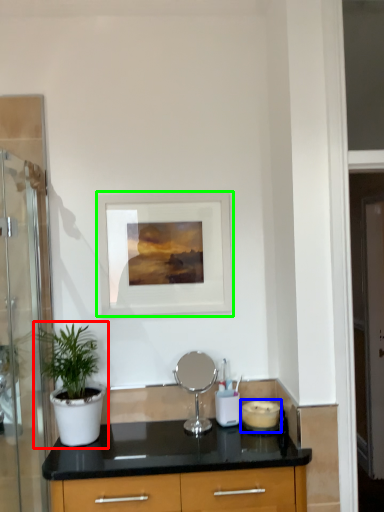
Question: Which is farther away from houseplant (highlighted by a red box)? appliance (highlighted by a blue box) or picture frame (highlighted by a green box)?

Choices:
 (A) appliance
 (B) picture frame

Answer: (A)